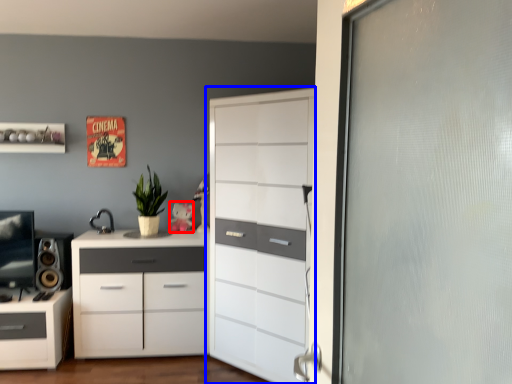
Question: Which object is closer to the camera taking this photo, toy (highlighted by a red box) or chest of drawers (highlighted by a blue box)?

Choices:
 (A) toy
 (B) chest of drawers

Answer: (B)